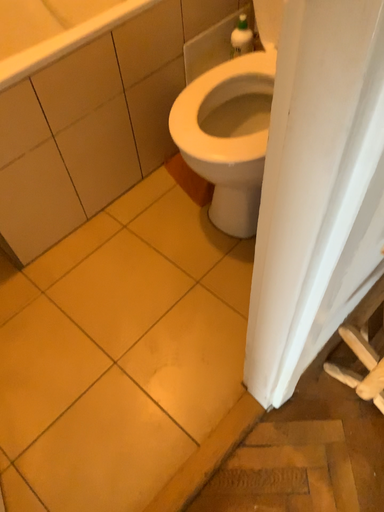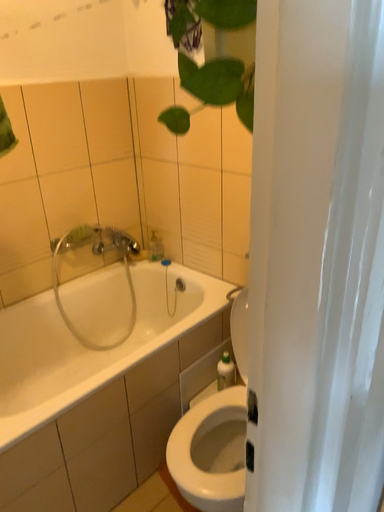
Question: How did the camera likely rotate when shooting the video?

Choices:
 (A) rotated upward
 (B) rotated downward

Answer: (A)